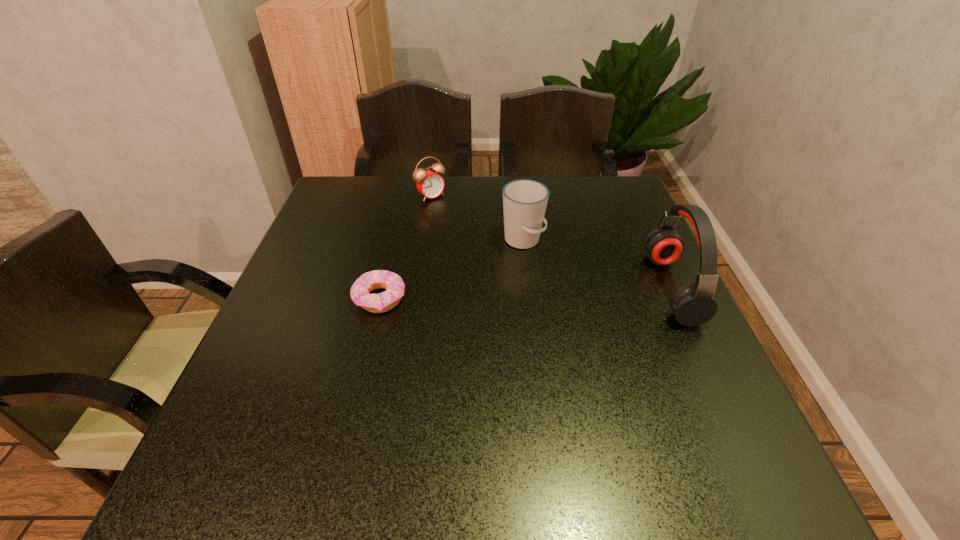
I want to click on free space on the desktop that is between the doughnut and the earphone and is positioned on the clock face of the second shortest object, so click(535, 293).

The image size is (960, 540). I want to click on free spot on the desktop that is between the doughnut and the rightmost object and is positioned with a handle on the side of the cup, so click(x=566, y=292).